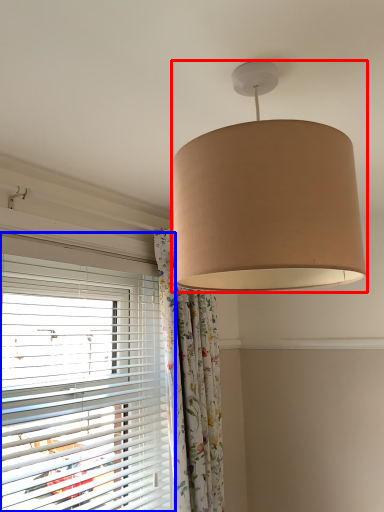
Question: Which point is further to the camera, lamp (highlighted by a red box) or window blind (highlighted by a blue box)?

Choices:
 (A) lamp
 (B) window blind

Answer: (B)